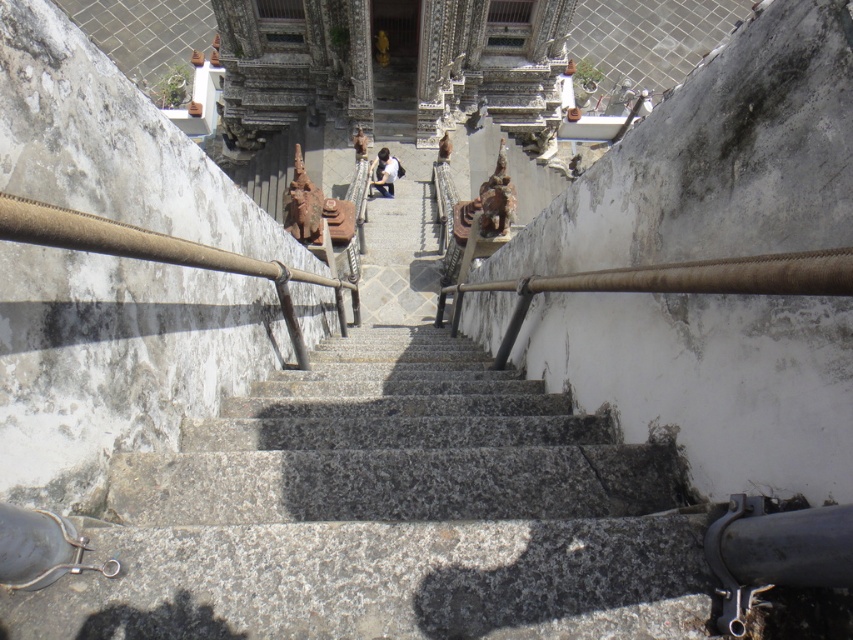
Is point (666, 564) closer to viewer compared to point (437, 150)?

Yes, it is in front of point (437, 150).

Can you confirm if granite stairs at center is thinner than smooth brown statue at center?

Correct, granite stairs at center's width is less than smooth brown statue at center's.

Where is `granite stairs at center`? This screenshot has height=640, width=853. granite stairs at center is located at coordinates (389, 515).

Which of these two, granite stairs at center or white matte shirt at center, stands shorter?

With less height is granite stairs at center.

Where is `granite stairs at center`? This screenshot has height=640, width=853. granite stairs at center is located at coordinates (389, 515).

Is point (418, 589) more distant than point (375, 170)?

No, it is in front of (375, 170).

At what (x,y) coordinates should I click in order to perform the action: click on granite stairs at center. Please return your answer as a coordinate pair (x, y). Looking at the image, I should click on (389, 515).

Can you confirm if white matte shirt at center is taller than smooth brown statue at center?

Yes.

Does white matte shirt at center lie behind smooth brown statue at center?

Yes, white matte shirt at center is further from the viewer.

Is point (386, 170) farther from camera compared to point (436, 161)?

No, (386, 170) is in front of (436, 161).

Locate an element on the screen. This screenshot has width=853, height=640. white matte shirt at center is located at coordinates (386, 172).